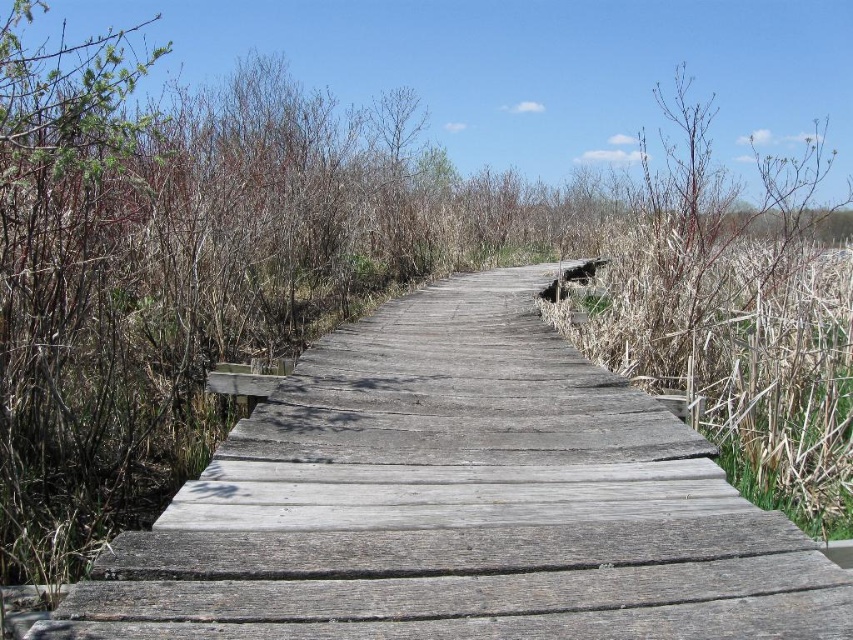
You are a maintenance worker needing to reach the dry grass at right from the weathered wood trail at center. Can you safely step across the gap between them if your maximum safe stepping distance is 9 feet?

The distance between the weathered wood trail at center and dry grass at right is 9.64 feet, which exceeds your maximum safe stepping distance of 9 feet. Therefore, it is not safe to step across the gap.

You are a park ranger assessing the boardwalk and surrounding vegetation. Based on the scene, which area takes up more space in the image, the weathered wood trail at center or the dry grass at right?

The dry grass at right occupies more space than the weathered wood trail at center in the image.